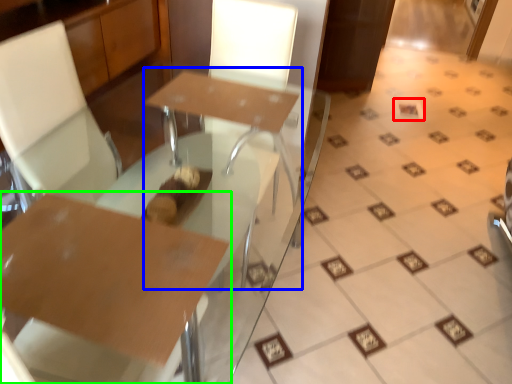
Question: Which object is the farthest from square (highlighted by a red box)? Choose among these: round table (highlighted by a blue box) or table (highlighted by a green box).

Choices:
 (A) round table
 (B) table

Answer: (B)